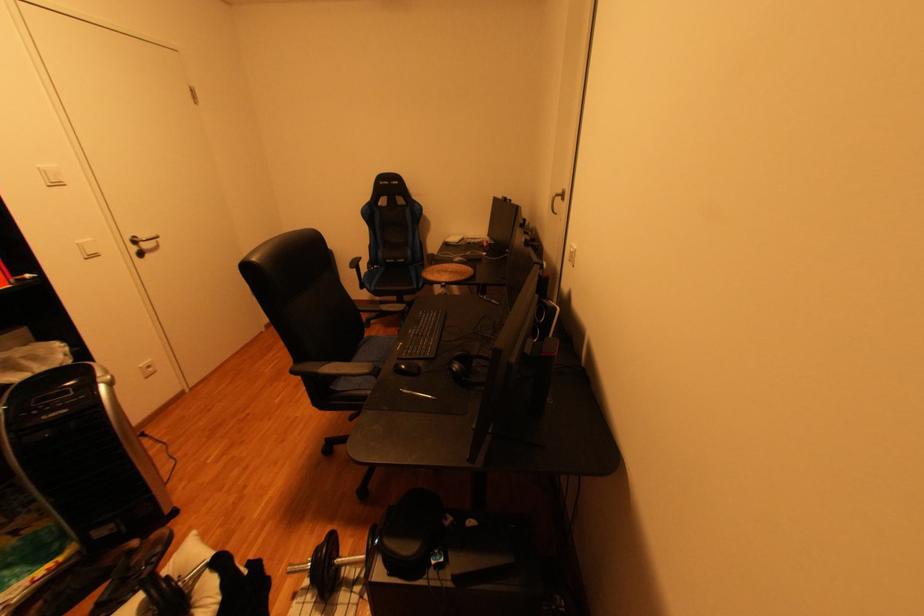
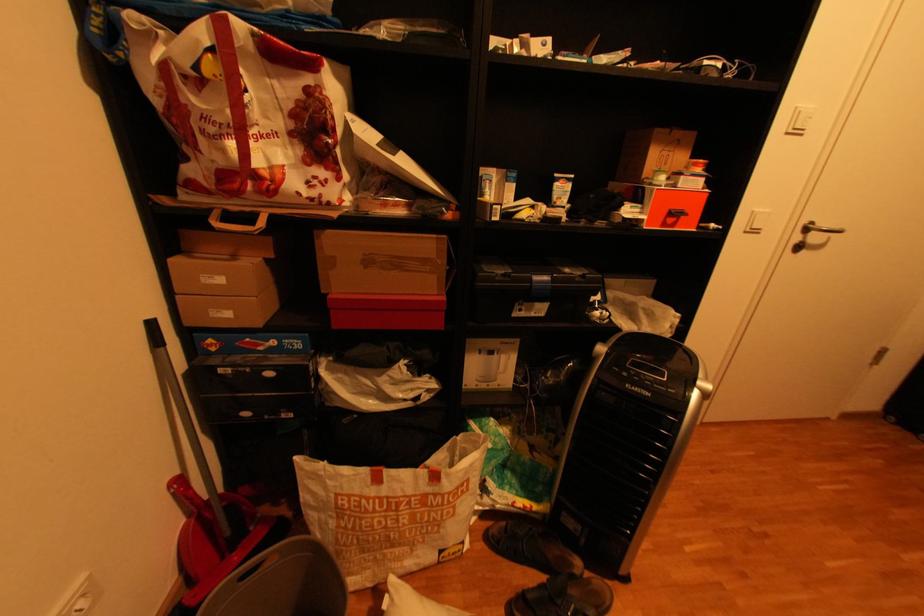
Find the pixel in the second image that matches pixel 144 243 in the first image.

(816, 230)